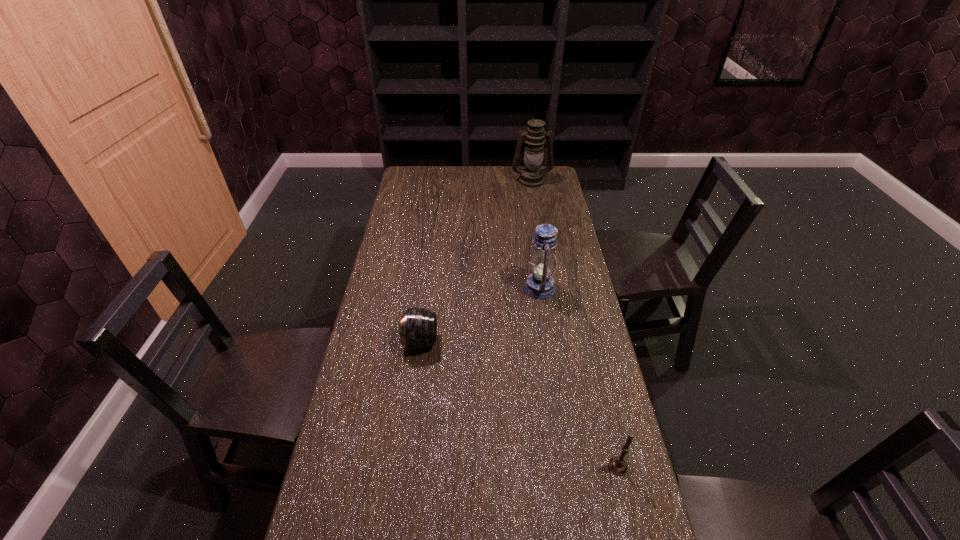
Where is `object that is the second nearest to the farthest object`? The image size is (960, 540). object that is the second nearest to the farthest object is located at coordinates (418, 328).

In order to click on vacant region that satisfies the following two spatial constraints: 1. at the front element of the telephoto lens; 2. on the back side of the third tallest object in this screenshot , I will do `click(405, 466)`.

Locate an element on the screen. free space that satisfies the following two spatial constraints: 1. at the front element of the second shortest object; 2. on the left side of the shortest object is located at coordinates (405, 466).

Locate an element on the screen. The height and width of the screenshot is (540, 960). vacant space that satisfies the following two spatial constraints: 1. on the front side of the oil lamp; 2. on the front-facing side of the lantern is located at coordinates (550, 288).

Identify the location of free space that satisfies the following two spatial constraints: 1. on the front-facing side of the lantern; 2. on the left side of the candle. (565, 466).